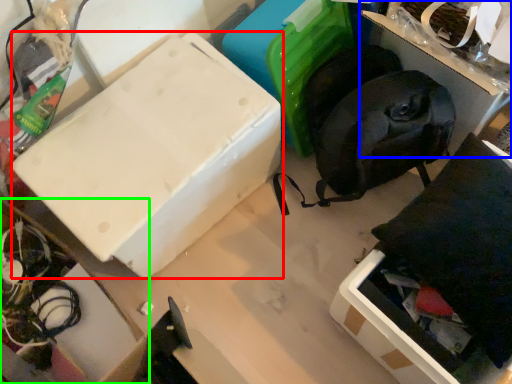
Question: Based on their relative distances, which object is nearer to box (highlighted by a red box)? Choose from storage box (highlighted by a blue box) and cardboard box (highlighted by a green box).

Choices:
 (A) storage box
 (B) cardboard box

Answer: (B)